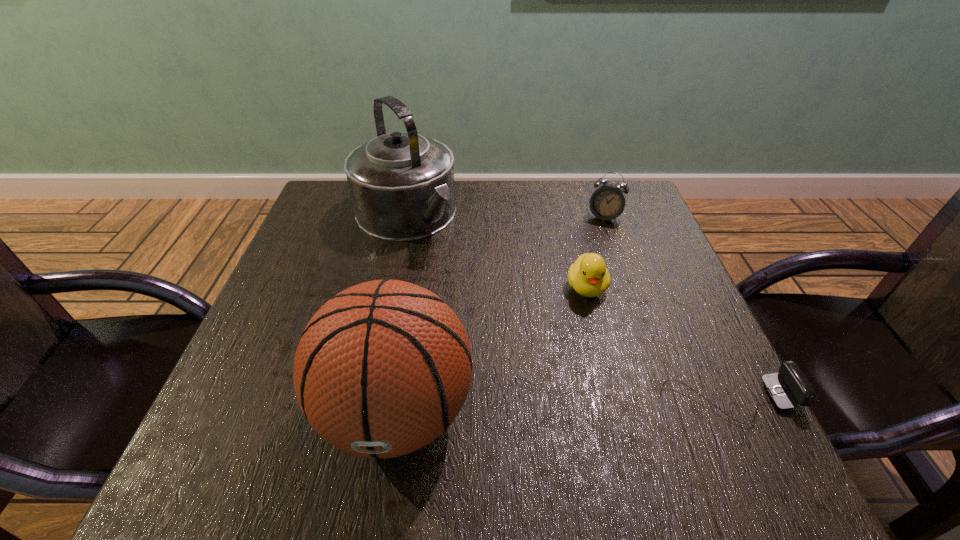
In the image, there is a desktop. Identify the location of free space at the far right corner. The height and width of the screenshot is (540, 960). (625, 194).

The width and height of the screenshot is (960, 540). In order to click on vacant space at the near right corner of the desktop in this screenshot , I will do `click(726, 394)`.

Locate an element on the screen. This screenshot has height=540, width=960. free space that is in between the alarm clock and the basketball is located at coordinates (500, 315).

I want to click on empty space that is in between the third farthest object and the basketball, so click(x=492, y=349).

This screenshot has height=540, width=960. What are the coordinates of `free space between the duckling and the kettle` in the screenshot? It's located at (496, 251).

In order to click on free space between the shortest object and the third shortest object in this screenshot , I will do `click(666, 309)`.

What are the coordinates of `vacant space in between the basketball and the alarm clock` in the screenshot? It's located at (500, 315).

Identify the location of unoccupied area between the third nearest object and the basketball. The height and width of the screenshot is (540, 960). (492, 349).

Identify which object is the fourth nearest to the alarm clock. Please provide its 2D coordinates. Your answer should be formatted as a tuple, i.e. [(x, y)], where the tuple contains the x and y coordinates of a point satisfying the conditions above.

[(382, 369)]

Select which object appears as the second closest to the webcam. Please provide its 2D coordinates. Your answer should be formatted as a tuple, i.e. [(x, y)], where the tuple contains the x and y coordinates of a point satisfying the conditions above.

[(382, 369)]